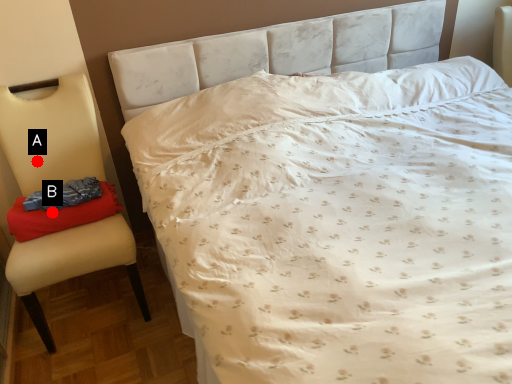
Question: Two points are circled on the image, labeled by A and B beside each circle. Among these points, which one is nearest to the camera?

Choices:
 (A) A is closer
 (B) B is closer

Answer: (B)